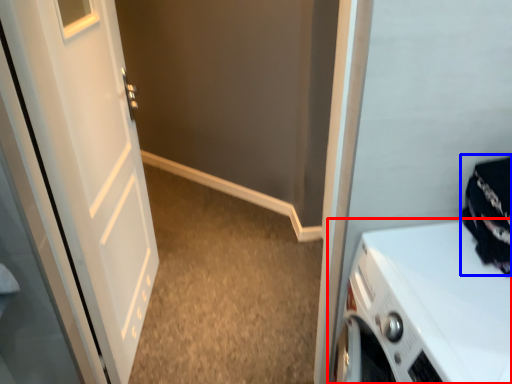
Question: Among these objects, which one is nearest to the camera, home appliance (highlighted by a red box) or clothing (highlighted by a blue box)?

Choices:
 (A) home appliance
 (B) clothing

Answer: (A)